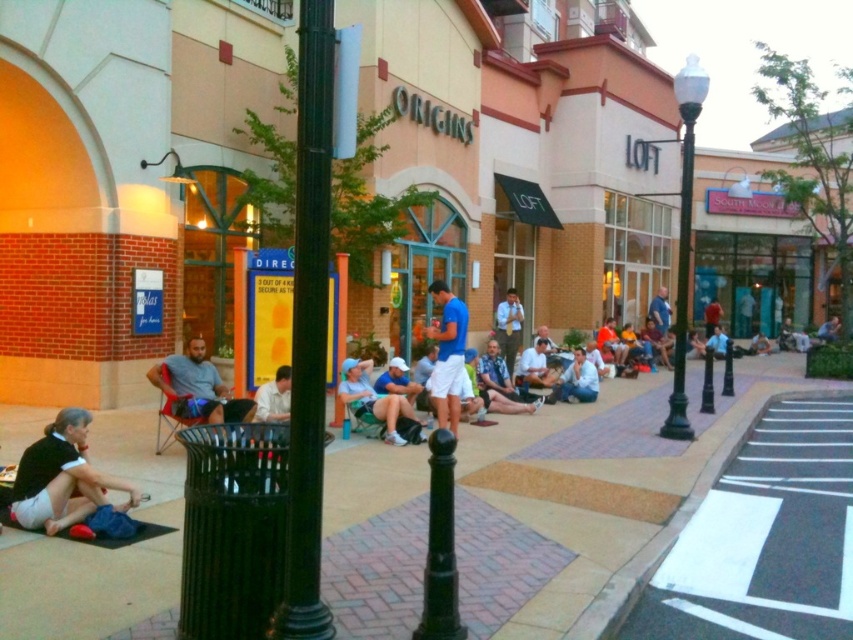
You are standing at the black trash bin near the center left of the frame and want to walk to the point at coordinates point (587,490). Which direction should you head?

The point (587,490) is on brick pavement at center. So you should head towards the center of the brick pavement from the black trash bin near the center left.

You are a photographer trying to capture both the matte black shirt at lower left and the light blue shirt at lower center in a single frame. Which shirt should you focus on first to ensure both are in the frame?

The matte black shirt at lower left is smaller in size compared to the light blue shirt at lower center, so you should focus on the matte black shirt at lower left first to ensure both are in the frame.

You are standing at the entrance of the shopping center and see two people wearing a matte black shirt at lower left and a light blue shirt at lower center. You want to greet both of them but can only walk 8 meters. Which person can you reach without exceeding your walking limit?

The matte black shirt at lower left is 9.00 meters from the light blue shirt at lower center. Since you can only walk 8 meters, you cannot reach either of them if you start from the entrance. However, if you are already at the entrance and the distance between the two shirts is 9 meters, you can only reach one of them within 8 meters. But without knowing your starting point relative to both, it is impossible to determine. However, based on the given information, the distance between them is 9 meters, so you